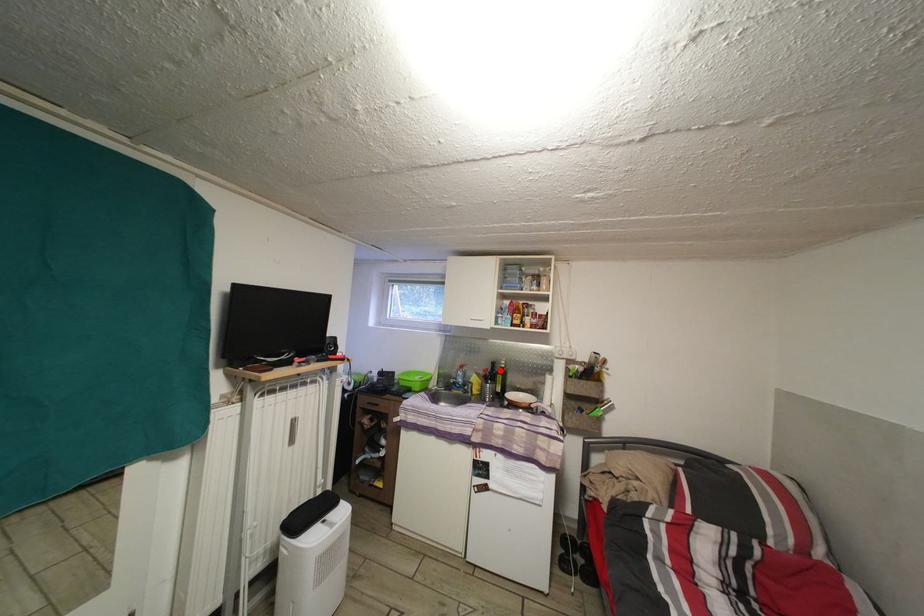
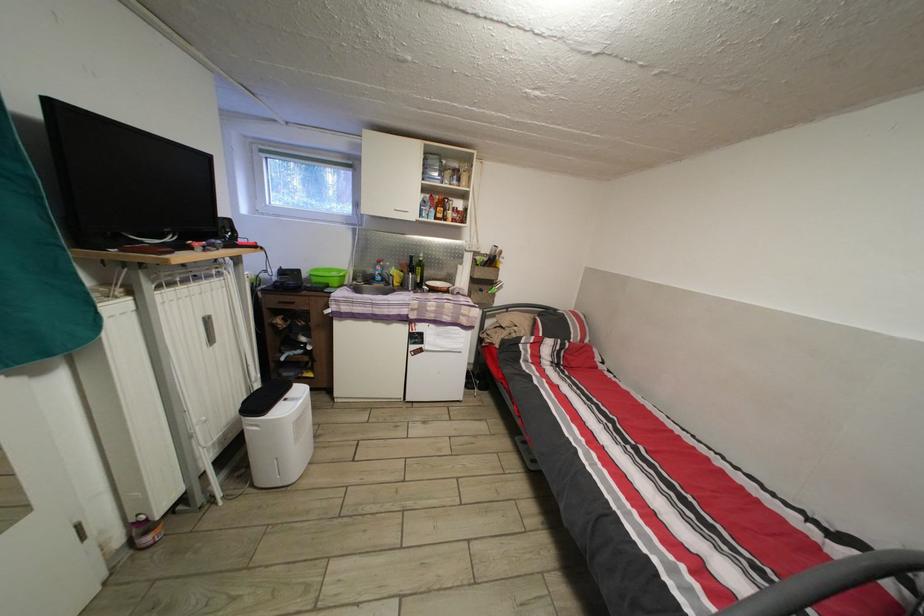
The point at the highlighted location is marked in the first image. Where is the corresponding point in the second image?

(419, 265)